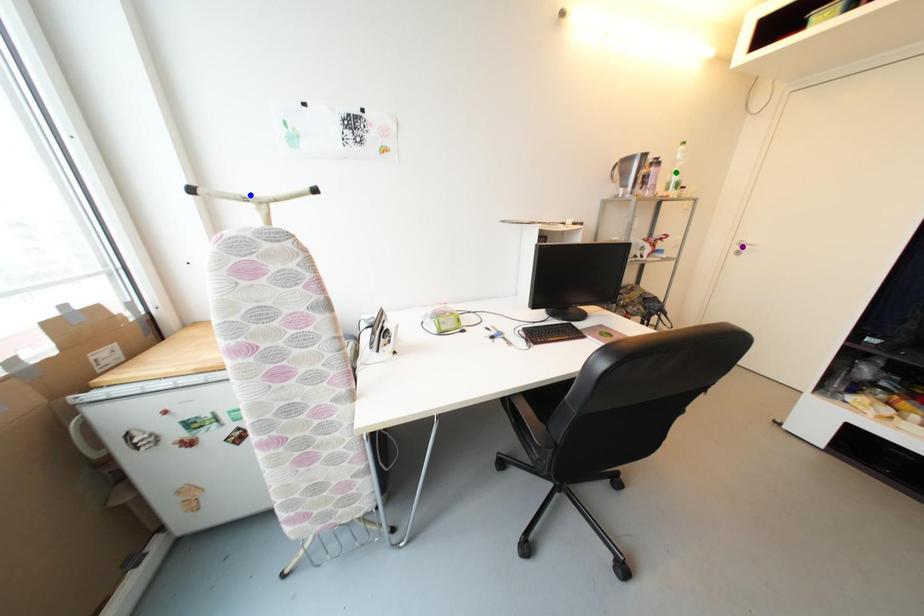
Order these from farthest to nearest:
A) blue point
B) green point
C) purple point

purple point < green point < blue point